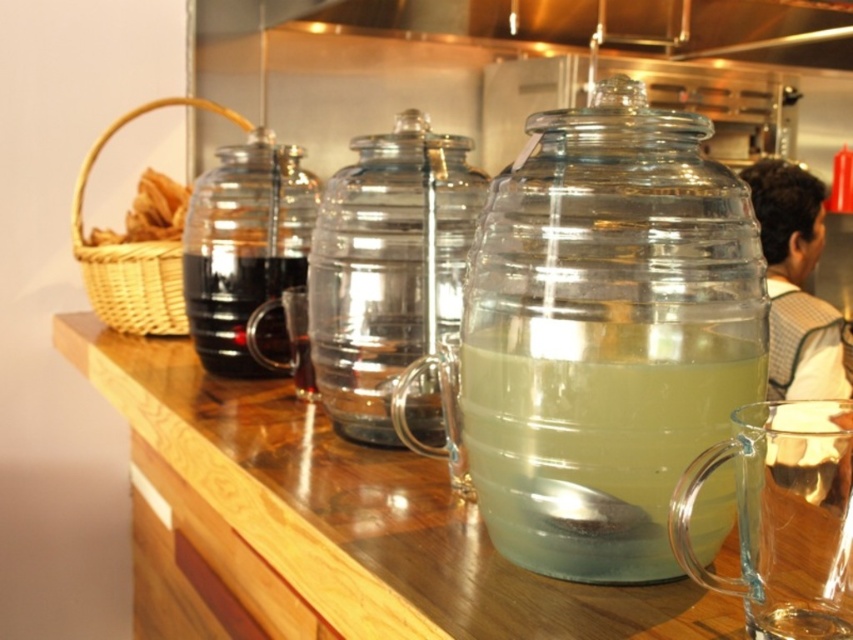
You are at a buffet and want to pour yourself a drink from the clear glass jug at center. However, there is a brown woven basket at left in the way. Can you reach the jug without moving the basket?

The clear glass jug at center is closer to the viewer than the brown woven basket at left, so you can reach the jug without moving the basket because it is nearer to you.

You are standing at the point with coordinates point (x=157, y=193) and want to reach the point with coordinates point (x=380, y=218). Which direction should you move to get there?

You should move forward because point (x=380, y=218) is in front of point (x=157, y=193).